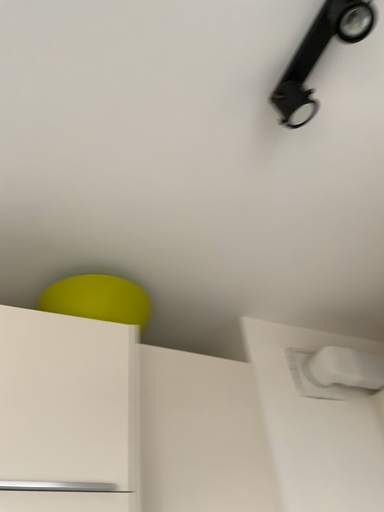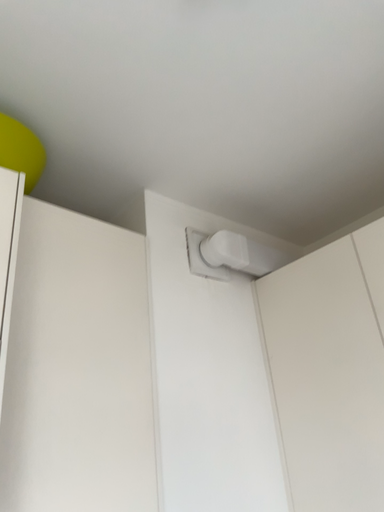
Question: Which way did the camera rotate in the video?

Choices:
 (A) rotated right
 (B) rotated left

Answer: (A)